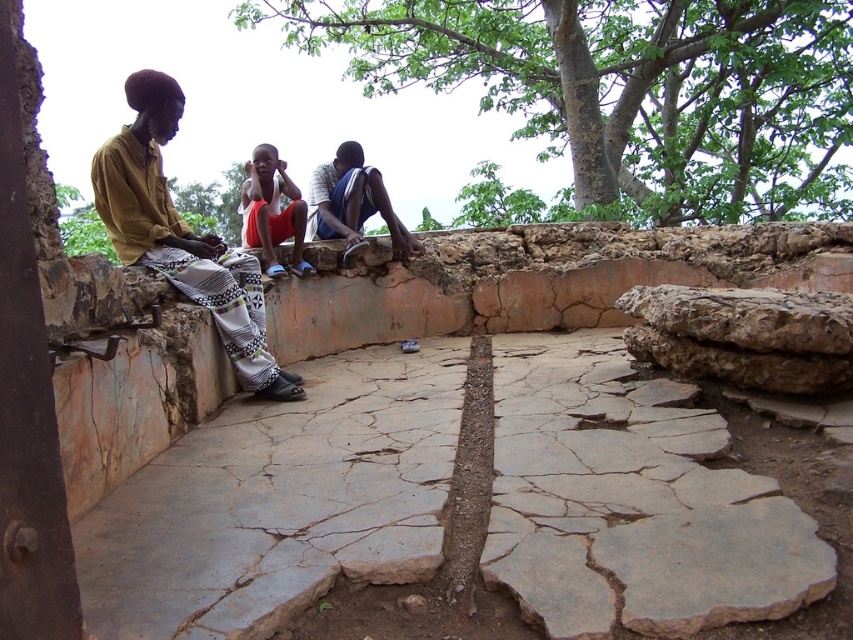
Does yellow fabric pants at left lie in front of blue fabric shorts at center?

Yes, it is.

Which is behind, point (132, 241) or point (317, 230)?

Positioned behind is point (317, 230).

At what (x,y) coordinates should I click in order to perform the action: click on yellow fabric pants at left. Please return your answer as a coordinate pair (x, y). Looking at the image, I should click on point(181,236).

Locate an element on the screen. The image size is (853, 640). yellow fabric pants at left is located at coordinates (181, 236).

Looking at this image, can you confirm if yellow fabric pants at left is thinner than orange cotton shorts at center?

In fact, yellow fabric pants at left might be wider than orange cotton shorts at center.

Does yellow fabric pants at left appear over orange cotton shorts at center?

No.

Is point (140, 230) positioned before point (264, 147)?

Yes, it is in front of point (264, 147).

The image size is (853, 640). I want to click on yellow fabric pants at left, so click(181, 236).

Which is more to the left, green leafy tree at upper center or orange cotton shorts at center?

orange cotton shorts at center is more to the left.

Between point (589, 67) and point (299, 244), which one is positioned in front?

Point (299, 244)

This screenshot has height=640, width=853. What do you see at coordinates (627, 88) in the screenshot?
I see `green leafy tree at upper center` at bounding box center [627, 88].

Find the location of a particular element. green leafy tree at upper center is located at coordinates (627, 88).